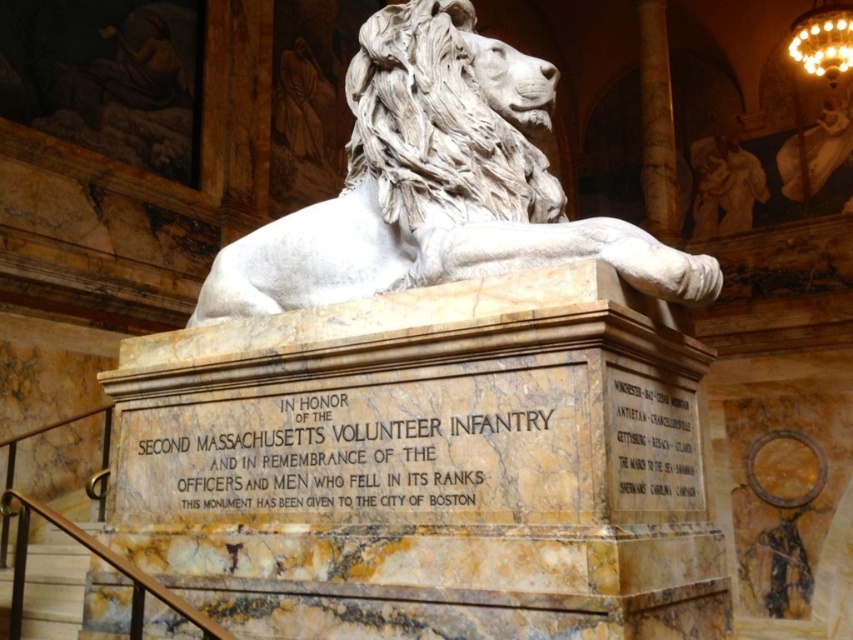
Question: Does white marble lion at center have a greater width compared to marble staircase at lower left?

Choices:
 (A) no
 (B) yes

Answer: (B)

Question: Where is black marble plaque at center located in relation to gold glass chandelier at upper right in the image?

Choices:
 (A) below
 (B) above

Answer: (A)

Question: Does white marble lion at center have a greater width compared to black marble plaque at center?

Choices:
 (A) no
 (B) yes

Answer: (B)

Question: Which object is the farthest from the gold metallic plaque at center?

Choices:
 (A) gold glass chandelier at upper right
 (B) white marble lion at center
 (C) black marble plaque at center

Answer: (A)

Question: Which point is farther from the camera taking this photo?

Choices:
 (A) (524, 236)
 (B) (271, 464)
 (C) (845, 52)
 (D) (59, 618)

Answer: (C)

Question: Which object is farther from the camera taking this photo?

Choices:
 (A) gold metallic plaque at center
 (B) gold glass chandelier at upper right
 (C) white marble lion at center

Answer: (B)